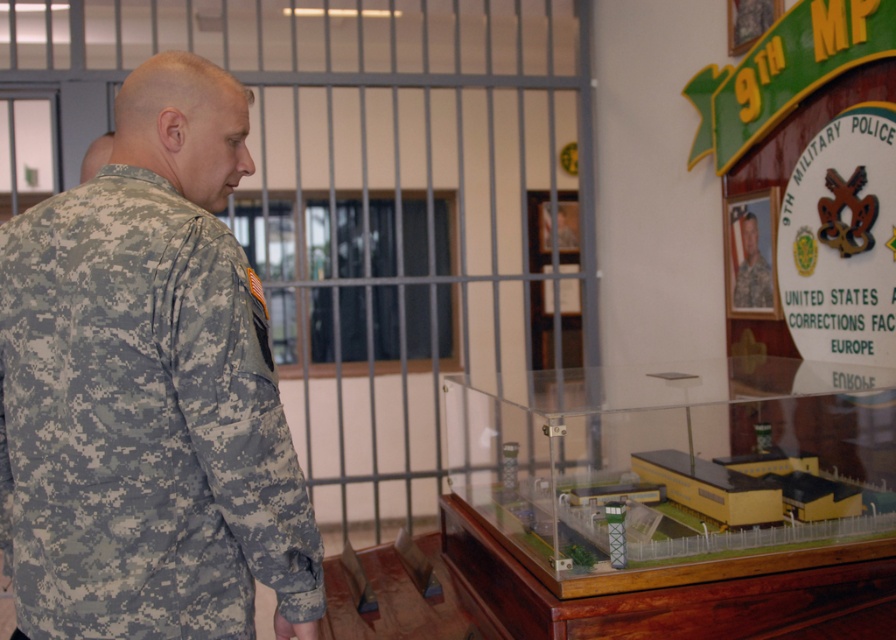
Between camouflage uniform at left and camouflage uniform at upper right, which one appears on the right side from the viewer's perspective?

camouflage uniform at upper right is more to the right.

Find the location of a particular element. The width and height of the screenshot is (896, 640). camouflage uniform at left is located at coordinates (148, 388).